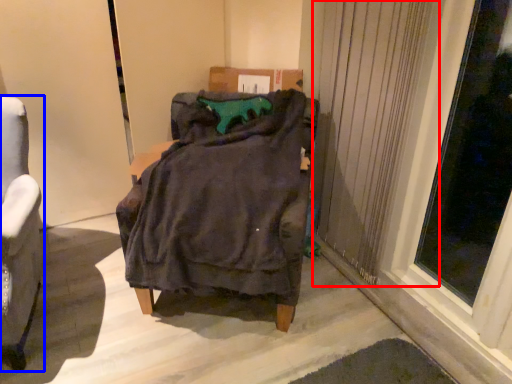
Question: Among these objects, which one is nearest to the camera, curtain (highlighted by a red box) or chair (highlighted by a blue box)?

Choices:
 (A) curtain
 (B) chair

Answer: (B)